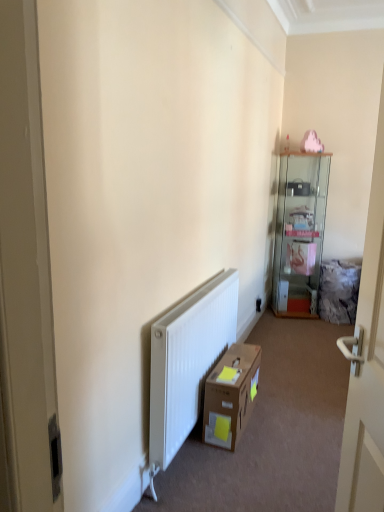
Locate an element on the screen. Image resolution: width=384 pixels, height=512 pixels. black plastic electric outlet at center is located at coordinates (258, 304).

What do you see at coordinates (258, 304) in the screenshot? I see `black plastic electric outlet at center` at bounding box center [258, 304].

Describe the element at coordinates (367, 362) in the screenshot. The height and width of the screenshot is (512, 384). I see `white glossy door at right` at that location.

The image size is (384, 512). What do you see at coordinates (299, 232) in the screenshot?
I see `clear glass cabinet at upper right` at bounding box center [299, 232].

Measure the distance between clear glass cabinet at upper right and camera.

4.21 meters.

The height and width of the screenshot is (512, 384). Find the location of `brown cardboard box at lower center`. brown cardboard box at lower center is located at coordinates (231, 396).

Considering the positions of point (291, 287) and point (259, 301), is point (291, 287) closer or farther from the camera than point (259, 301)?

Point (291, 287) appears to be farther away from the viewer than point (259, 301).

Is clear glass cabinet at upper right positioned with its back to black plastic electric outlet at center?

No, black plastic electric outlet at center is not at the back of clear glass cabinet at upper right.

The height and width of the screenshot is (512, 384). Identify the location of cabinetry that appears above the black plastic electric outlet at center (from a real-world perspective). (299, 232).

Looking at their sizes, would you say clear glass cabinet at upper right is wider or thinner than black plastic electric outlet at center?

Clearly, clear glass cabinet at upper right has more width compared to black plastic electric outlet at center.

Considering the relative sizes of white glossy door at right and clear glass cabinet at upper right in the image provided, is white glossy door at right thinner than clear glass cabinet at upper right?

Indeed, white glossy door at right has a lesser width compared to clear glass cabinet at upper right.

From the image's perspective, who appears lower, white glossy door at right or clear glass cabinet at upper right?

white glossy door at right, from the image's perspective.

Where is `door lying on the left of clear glass cabinet at upper right`? This screenshot has height=512, width=384. door lying on the left of clear glass cabinet at upper right is located at coordinates (367, 362).

Is white glossy door at right with clear glass cabinet at upper right?

No, white glossy door at right is not with clear glass cabinet at upper right.

Which object is more forward, clear glass cabinet at upper right or brown cardboard box at lower center?

brown cardboard box at lower center is closer to the camera.

Considering the relative positions of clear glass cabinet at upper right and brown cardboard box at lower center in the image provided, is clear glass cabinet at upper right to the left of brown cardboard box at lower center from the viewer's perspective?

No.

Are clear glass cabinet at upper right and brown cardboard box at lower center far apart?

Yes, clear glass cabinet at upper right and brown cardboard box at lower center are located far from each other.

Can you confirm if clear glass cabinet at upper right is smaller than brown cardboard box at lower center?

Actually, clear glass cabinet at upper right might be larger than brown cardboard box at lower center.

Does brown cardboard box at lower center have a lesser height compared to black plastic electric outlet at center?

In fact, brown cardboard box at lower center may be taller than black plastic electric outlet at center.

The height and width of the screenshot is (512, 384). What are the coordinates of `cardboard box on the left of black plastic electric outlet at center` in the screenshot? It's located at (231, 396).

Considering the relative positions of brown cardboard box at lower center and black plastic electric outlet at center in the image provided, is brown cardboard box at lower center behind black plastic electric outlet at center?

No, brown cardboard box at lower center is in front of black plastic electric outlet at center.

Would you say brown cardboard box at lower center is to the left or to the right of white glossy door at right in the picture?

Clearly, brown cardboard box at lower center is on the left of white glossy door at right in the image.

Considering the points (243, 403) and (372, 263), which point is in front, point (243, 403) or point (372, 263)?

The point (372, 263) is closer to the camera.

From the picture: Is brown cardboard box at lower center outside of white glossy door at right?

brown cardboard box at lower center is positioned outside white glossy door at right.

Does brown cardboard box at lower center have a lesser width compared to white glossy door at right?

In fact, brown cardboard box at lower center might be wider than white glossy door at right.

Consider the image. Considering the relative sizes of clear glass cabinet at upper right and white glossy door at right in the image provided, is clear glass cabinet at upper right thinner than white glossy door at right?

No.

Considering the sizes of objects clear glass cabinet at upper right and white glossy door at right in the image provided, who is taller, clear glass cabinet at upper right or white glossy door at right?

clear glass cabinet at upper right.

You are a GUI agent. You are given a task and a screenshot of the screen. Output one action in this format:
    pyautogui.click(x=<x>, y=<y>)
    Task: Click on the door that is in front of the clear glass cabinet at upper right
    This screenshot has height=512, width=384.
    Given the screenshot: What is the action you would take?
    pyautogui.click(x=367, y=362)

Can you tell me how much clear glass cabinet at upper right and white glossy door at right differ in facing direction?

clear glass cabinet at upper right and white glossy door at right are facing 84.5 degrees away from each other.

Considering the relative positions of black plastic electric outlet at center and clear glass cabinet at upper right in the image provided, is black plastic electric outlet at center in front of clear glass cabinet at upper right?

No, it is not.

Is clear glass cabinet at upper right at the back of black plastic electric outlet at center?

No.

From the image's perspective, between black plastic electric outlet at center and clear glass cabinet at upper right, which one is located above?

clear glass cabinet at upper right.

Find the location of a particular element. electric outlet located behind the clear glass cabinet at upper right is located at coordinates (258, 304).

Identify the location of door lying on the left of clear glass cabinet at upper right. This screenshot has height=512, width=384. (367, 362).

Based on their spatial positions, is black plastic electric outlet at center or white glossy door at right further from brown cardboard box at lower center?

black plastic electric outlet at center is further to brown cardboard box at lower center.

From the picture: Considering their positions, is white glossy door at right positioned further to brown cardboard box at lower center than clear glass cabinet at upper right?

clear glass cabinet at upper right is positioned further to the anchor brown cardboard box at lower center.

Based on their spatial positions, is clear glass cabinet at upper right or black plastic electric outlet at center further from white glossy door at right?

black plastic electric outlet at center.

Which object lies nearer to the anchor point brown cardboard box at lower center, black plastic electric outlet at center or clear glass cabinet at upper right?

The object closer to brown cardboard box at lower center is black plastic electric outlet at center.

When comparing their distances from black plastic electric outlet at center, does brown cardboard box at lower center or clear glass cabinet at upper right seem further?

The object further to black plastic electric outlet at center is brown cardboard box at lower center.

Considering their positions, is clear glass cabinet at upper right positioned further to black plastic electric outlet at center than white glossy door at right?

white glossy door at right lies further to black plastic electric outlet at center than the other object.

Estimate the real-world distances between objects in this image. Which object is further from clear glass cabinet at upper right, white glossy door at right or black plastic electric outlet at center?

Among the two, white glossy door at right is located further to clear glass cabinet at upper right.

Estimate the real-world distances between objects in this image. Which object is closer to brown cardboard box at lower center, clear glass cabinet at upper right or black plastic electric outlet at center?

The object closer to brown cardboard box at lower center is black plastic electric outlet at center.

Locate an element on the screen. This screenshot has width=384, height=512. cardboard box between white glossy door at right and clear glass cabinet at upper right from front to back is located at coordinates (231, 396).

At what (x,y) coordinates should I click in order to perform the action: click on cardboard box between white glossy door at right and black plastic electric outlet at center along the z-axis. Please return your answer as a coordinate pair (x, y). This screenshot has width=384, height=512. Looking at the image, I should click on (231, 396).

Where is `cabinetry between white glossy door at right and black plastic electric outlet at center in the front-back direction`? The height and width of the screenshot is (512, 384). cabinetry between white glossy door at right and black plastic electric outlet at center in the front-back direction is located at coordinates (299, 232).

Where is `cabinetry between brown cardboard box at lower center and black plastic electric outlet at center from front to back`? Image resolution: width=384 pixels, height=512 pixels. cabinetry between brown cardboard box at lower center and black plastic electric outlet at center from front to back is located at coordinates (299, 232).